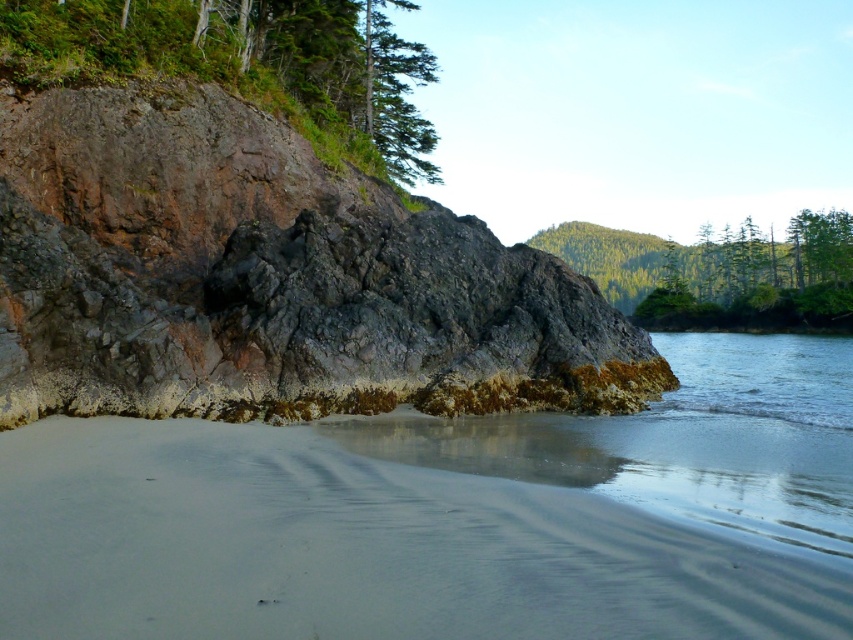
You are standing on the sandy beach in the image and notice a specific point marked at coordinates (267, 278). What object is located at that point?

The rusty stone cliff at center left is located at point (267, 278).

You are standing on the beach looking at the cliff. There are two points marked on the cliff face. The first point is at coordinates point (219, 67) and the second is at point (407, 72). Which point is closer to you?

Point (219, 67) is closer to the viewer than point (407, 72).